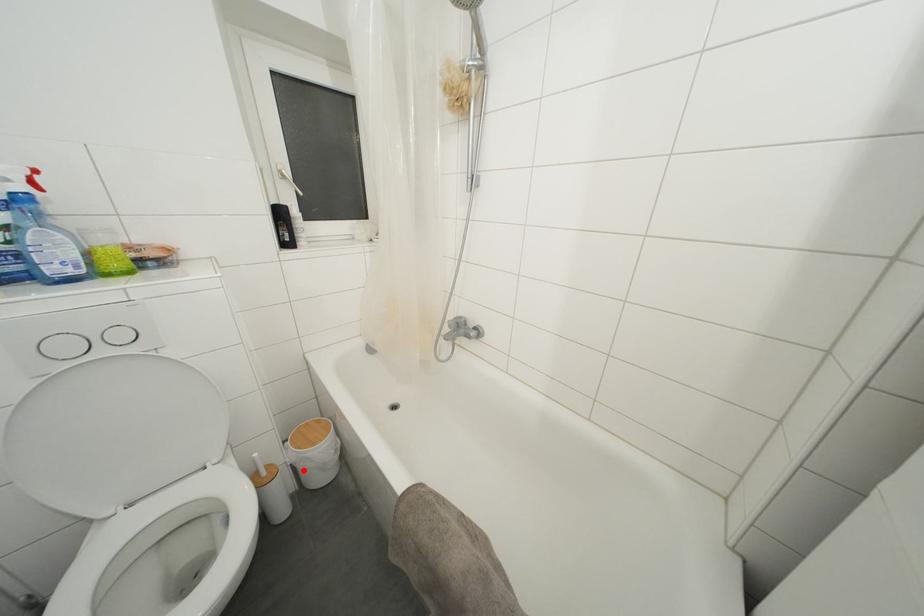
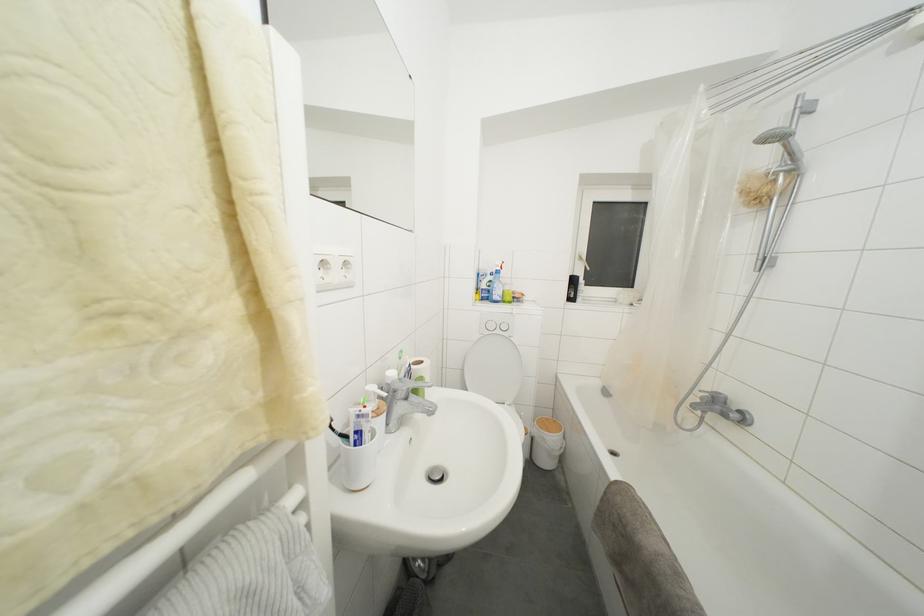
Question: A red point is marked in image1. In image2, is the corresponding 3D point closer to the camera or farther? Reply with the corresponding letter.

Choices:
 (A) The corresponding 3D point is closer.
 (B) The corresponding 3D point is farther.

Answer: (B)